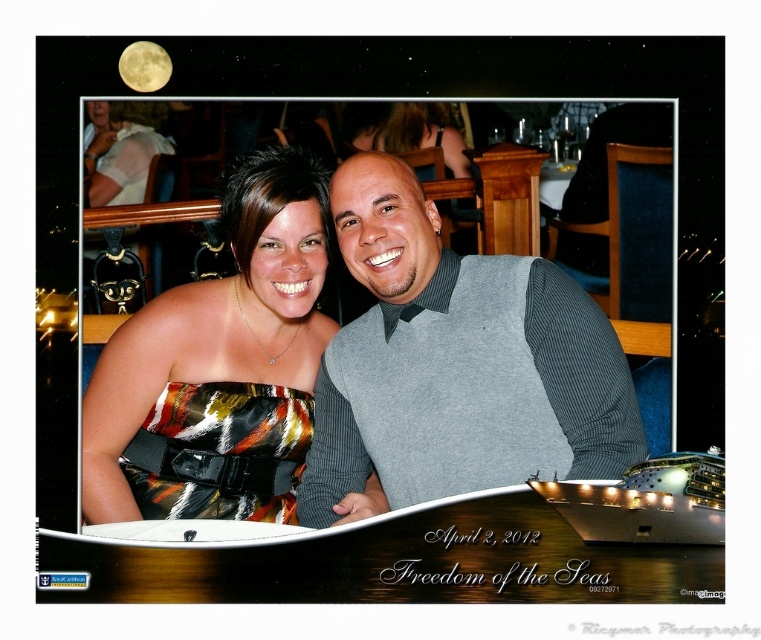
You are standing in front of a framed photo of two people on a cruise ship. The photo shows a gray ribbed sweater at center and a shiny satin dress at center. Which clothing item is positioned closer to you?

The gray ribbed sweater at center is closer to the viewer than the shiny satin dress at center.

You are a photographer trying to capture a group photo of the gray ribbed sweater at center and the shiny satin dress at center. If you want to ensure both are fully visible in the frame, which object should you position closer to the camera?

The gray ribbed sweater at center might be wider than the shiny satin dress at center, so positioning the gray ribbed sweater at center closer to the camera would help ensure both are fully visible in the frame.